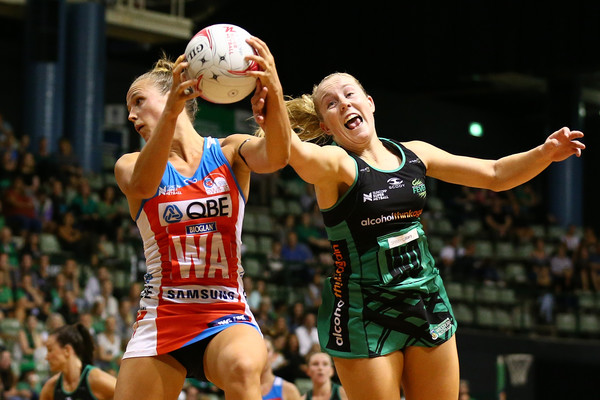
You are a GUI agent. You are given a task and a screenshot of the screen. Output one action in this format:
    pyautogui.click(x=<x>, y=<y>)
    Task: Click on the columns
    Image resolution: width=600 pixels, height=400 pixels.
    Given the screenshot: What is the action you would take?
    pyautogui.click(x=573, y=195), pyautogui.click(x=89, y=109), pyautogui.click(x=47, y=112)